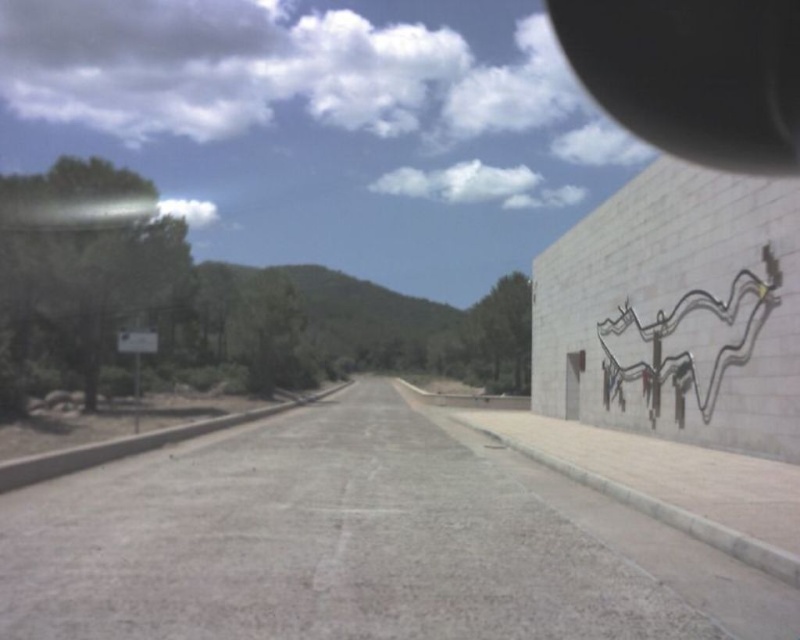
You are standing at the edge of the road and want to walk towards the signpost near the left edge. There are two points marked on the road at coordinates point (x=664, y=29) and point (x=674, y=314). Which point is closer to your current position?

Point (x=664, y=29) is closer to your current position because it is further to the viewer than point (x=674, y=314), meaning it is nearer to where you are standing.

You are a delivery driver approaching the road and need to check your surroundings. Which object, the black rubber view mirror at upper right or the metallic silver octopus at right, would allow you to see a wider area behind your vehicle?

The black rubber view mirror at upper right has a larger size compared to the metallic silver octopus at right, so it would allow you to see a wider area behind your vehicle.

You are driving a car and need to check your blind spot. You see a black rubber view mirror at upper right and a metallic silver octopus at right. Which object is wider and can give a better view?

The black rubber view mirror at upper right is wider than the metallic silver octopus at right, so it can provide a better view for checking the blind spot.